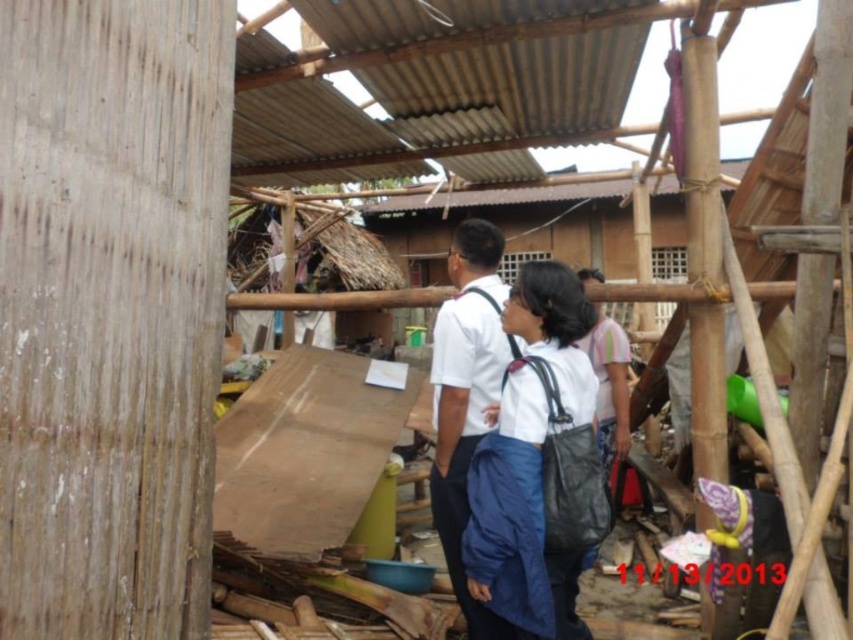
Question: Which point is closer to the camera?

Choices:
 (A) (450, 252)
 (B) (524, 422)

Answer: (B)

Question: Considering the relative positions of white fabric backpack at center and white matte shirt at center in the image provided, where is white fabric backpack at center located with respect to white matte shirt at center?

Choices:
 (A) right
 (B) left

Answer: (A)

Question: Can you confirm if white fabric backpack at center is bigger than white matte shirt at center?

Choices:
 (A) no
 (B) yes

Answer: (B)

Question: Which of the following is the closest to the observer?

Choices:
 (A) (537, 502)
 (B) (485, 392)

Answer: (A)

Question: Does white fabric backpack at center have a greater width compared to white matte shirt at center?

Choices:
 (A) yes
 (B) no

Answer: (A)